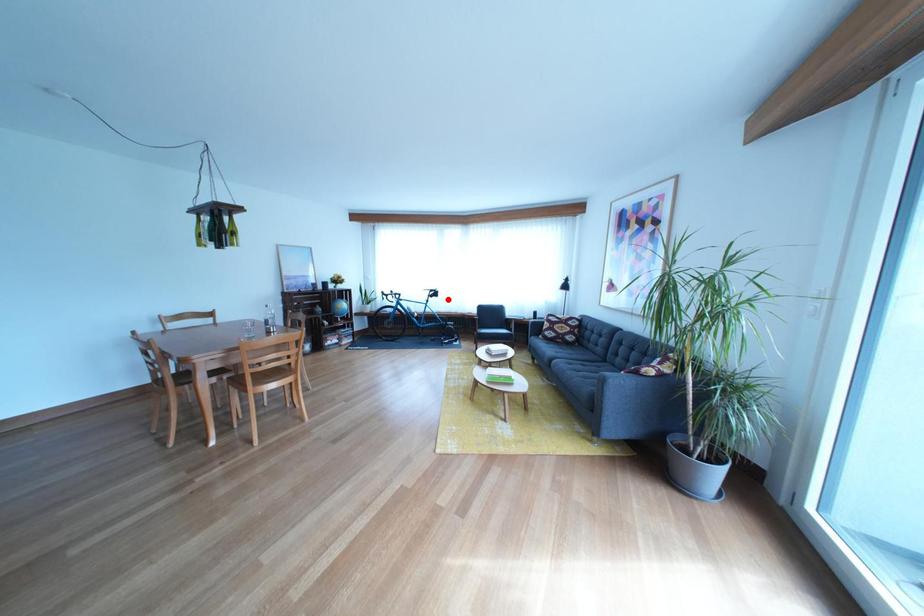
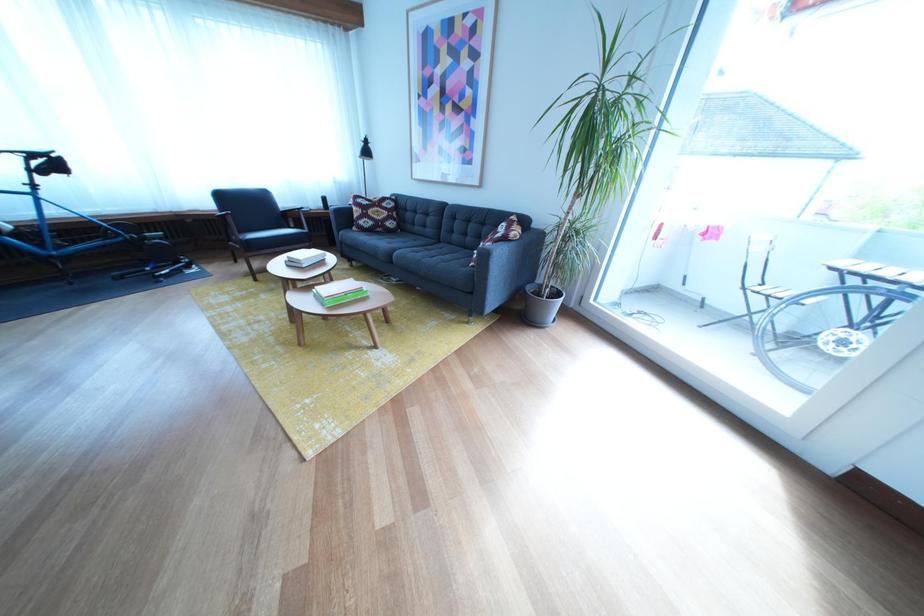
In the second image, find the point that corresponds to the highlighted location in the first image.

(64, 169)